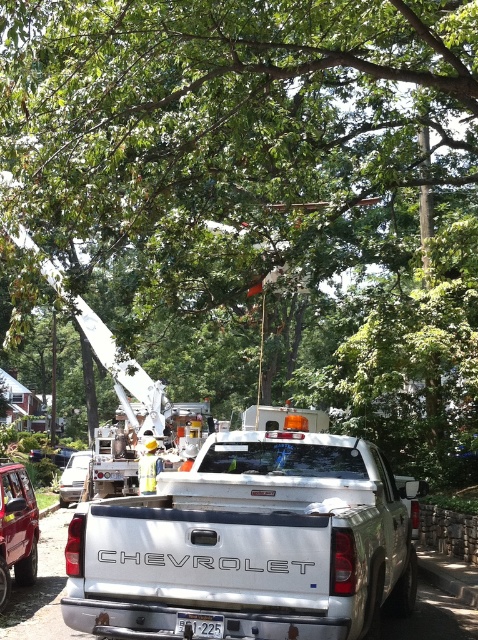
You are a delivery driver who needs to park your truck in a garage that has a height restriction of 6 feet. Based on the scene, can you determine if the white metallic truck at center and the white plastic license plate at center will fit under the height limit?

The white metallic truck at center is much taller than the white plastic license plate at center. Since the license plate is typically mounted on the rear of the vehicle and is part of the truck, the truck itself exceeds the height of the license plate. Therefore, if the license plate is under 6 feet, the truck might still be too tall. However, without knowing the exact height of the license plate, it is uncertain whether the truck meets the 6 feet requirement.

You are a pedestrian standing on the sidewalk and see the metallic silver van at center and the white plastic license plate at center. Which object is closer to you?

The metallic silver van at center is closer to you because it is positioned further to the viewer than the white plastic license plate at center, meaning it appears nearer in the scene.

You are a delivery person who needs to unload a package that requires a clearance of 1.5 meters between the truck and the license plate. Can you safely place the package between the white metallic truck at center and the white plastic license plate at center?

The distance between the white metallic truck at center and the white plastic license plate at center is 1.36 meters, which is less than the required 1.5 meters clearance. Therefore, the package cannot be safely placed between them due to insufficient space.